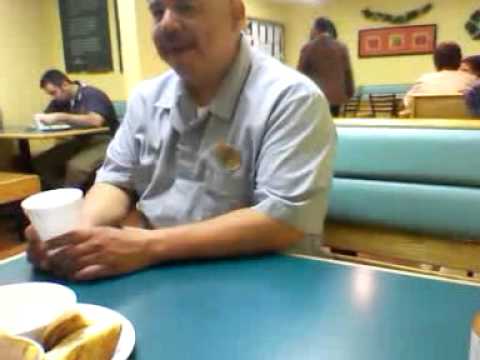
At what (x,y) coordinates should I click in order to perform the action: click on white plate. Please return your answer as a coordinate pair (x, y). The width and height of the screenshot is (480, 360). Looking at the image, I should click on (104, 317).